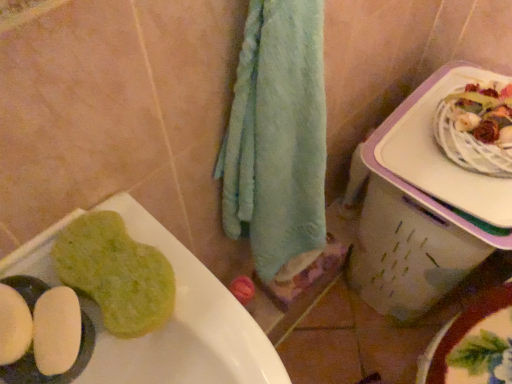
Question: From the image's perspective, does white plastic lunch box at right appear lower than green sponge at lower left?

Choices:
 (A) no
 (B) yes

Answer: (A)

Question: Can you confirm if white plastic lunch box at right is bigger than green sponge at lower left?

Choices:
 (A) no
 (B) yes

Answer: (B)

Question: Is green sponge at lower left inside white plastic lunch box at right?

Choices:
 (A) no
 (B) yes

Answer: (A)

Question: Is white plastic lunch box at right far from green sponge at lower left?

Choices:
 (A) no
 (B) yes

Answer: (A)

Question: Could you tell me if white plastic lunch box at right is facing green sponge at lower left?

Choices:
 (A) no
 (B) yes

Answer: (B)

Question: From the image's perspective, is white plastic lunch box at right on top of green sponge at lower left?

Choices:
 (A) yes
 (B) no

Answer: (A)

Question: Would you say green sponge at lower left is a long distance from white plastic lunch box at right?

Choices:
 (A) no
 (B) yes

Answer: (A)

Question: Considering the relative sizes of green sponge at lower left and white plastic lunch box at right in the image provided, is green sponge at lower left shorter than white plastic lunch box at right?

Choices:
 (A) yes
 (B) no

Answer: (A)

Question: Is green sponge at lower left thinner than white plastic lunch box at right?

Choices:
 (A) yes
 (B) no

Answer: (A)

Question: Considering the relative positions of green sponge at lower left and white plastic lunch box at right in the image provided, is green sponge at lower left to the left of white plastic lunch box at right from the viewer's perspective?

Choices:
 (A) yes
 (B) no

Answer: (A)

Question: Considering the relative positions of green sponge at lower left and white plastic lunch box at right in the image provided, is green sponge at lower left behind white plastic lunch box at right?

Choices:
 (A) yes
 (B) no

Answer: (B)

Question: From a real-world perspective, does green sponge at lower left sit lower than white plastic lunch box at right?

Choices:
 (A) no
 (B) yes

Answer: (A)

Question: Is green sponge at lower left at the right side of white plastic lunch box at right?

Choices:
 (A) no
 (B) yes

Answer: (A)